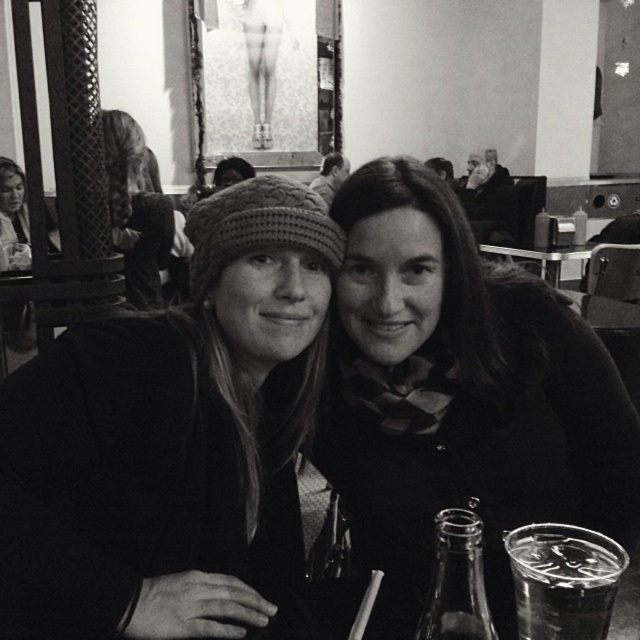
You are a photographer trying to capture a closeup of the knitted wool hat at upper left and the smooth leather jacket at upper center. Since you want both items to appear equally prominent in the photo, which one should you zoom in more on?

The knitted wool hat at upper left has a smaller size compared to smooth leather jacket at upper center. To make both appear equally prominent, you should zoom in more on the knitted wool hat at upper left to compensate for its smaller size.

You are a photographer trying to capture a closeup of the matte black scarf at center. The camera you are using has a focal length of 50mm and an aperture of f2.8. The camera is positioned at point A, which is 1.5 meters away from the table. The camera must be moved in a straight line to a new position to focus on the scarf. What is the minimum distance you need to move the camera to ensure the scarf is in focus?

The minimum distance to move the camera is the distance between point A and the position where the camera can focus on the matte black scarf at center at point (x=458, y=396). However, without knowing the exact coordinates of point A or the camera sensor size and depth of field, it is impossible to calculate the precise distance. Therefore, the photographer should move the camera directly towards the scarf until it comes into focus, which would be the shortest path.